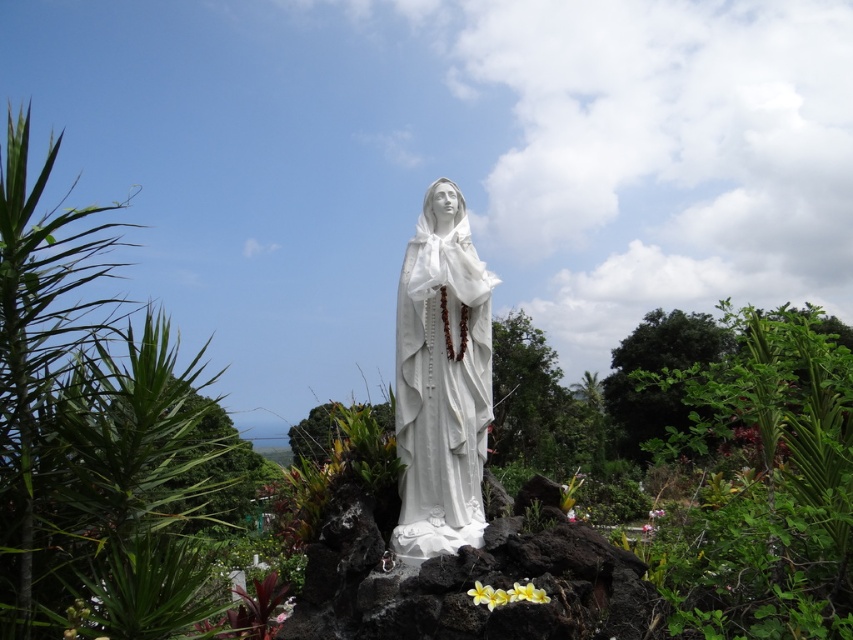
Does green leafy plant at center right have a lesser width compared to white marble statue at center?

No, green leafy plant at center right is not thinner than white marble statue at center.

Is green leafy plant at center right to the right of white marble statue at center from the viewer's perspective?

Yes, green leafy plant at center right is to the right of white marble statue at center.

Between point (831, 376) and point (456, 227), which one is positioned in front?

Point (831, 376) is in front.

The image size is (853, 640). Identify the location of green leafy plant at center right. (764, 480).

Can you confirm if yellow matte flower at lower center is shorter than white matte flower at center?

Indeed, yellow matte flower at lower center has a lesser height compared to white matte flower at center.

You are a GUI agent. You are given a task and a screenshot of the screen. Output one action in this format:
    pyautogui.click(x=<x>, y=<y>)
    Task: Click on the yellow matte flower at lower center
    
    Given the screenshot: What is the action you would take?
    pyautogui.click(x=506, y=595)

Which of these two, white marble statue at center or white matte flower at center, stands shorter?

With less height is white matte flower at center.

Is white marble statue at center in front of white matte flower at center?

Yes, white marble statue at center is closer to the viewer.

Measure the distance between point (405, 464) and camera.

Point (405, 464) is 10.48 feet away from camera.

Where is `white marble statue at center`? The image size is (853, 640). white marble statue at center is located at coordinates (440, 381).